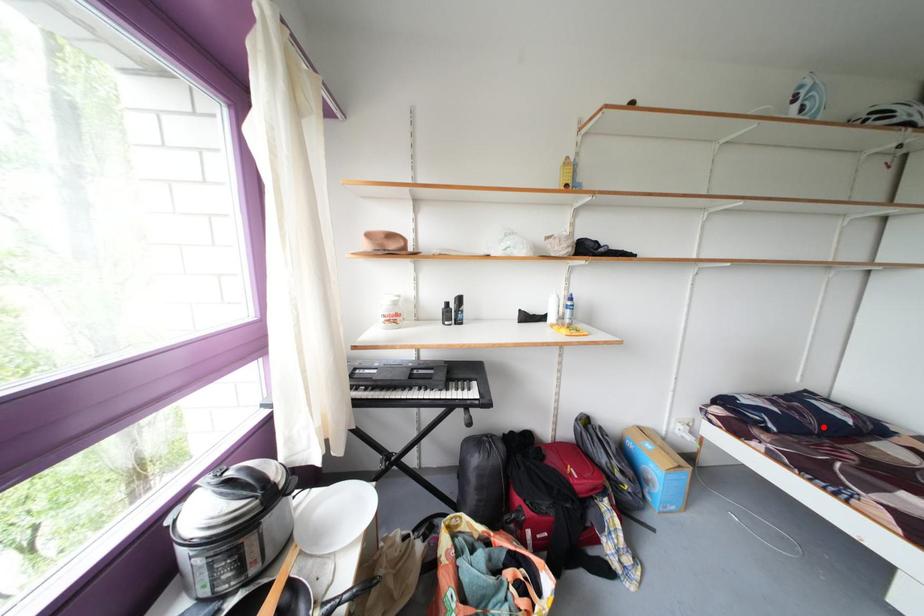
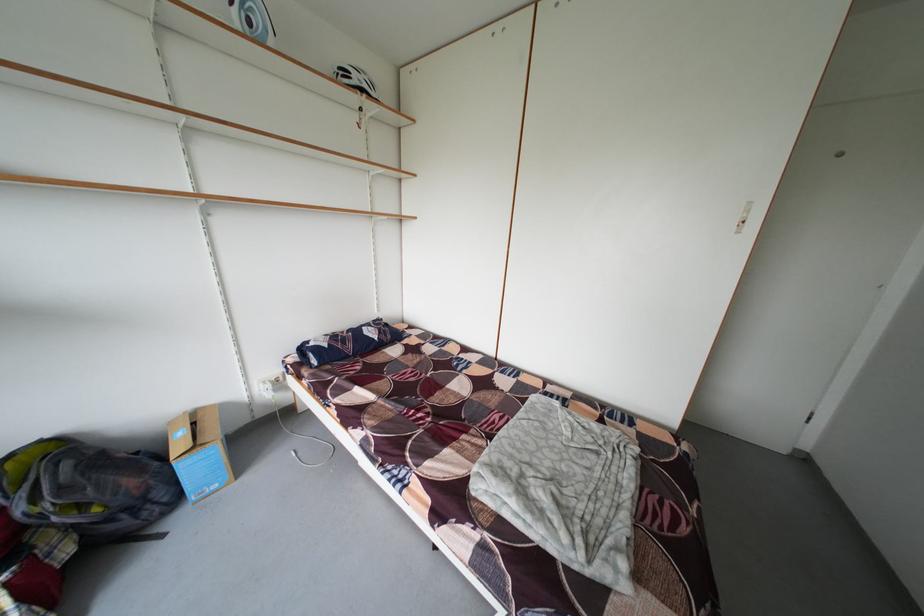
The point at the highlighted location is marked in the first image. Where is the corresponding point in the second image?

(360, 351)